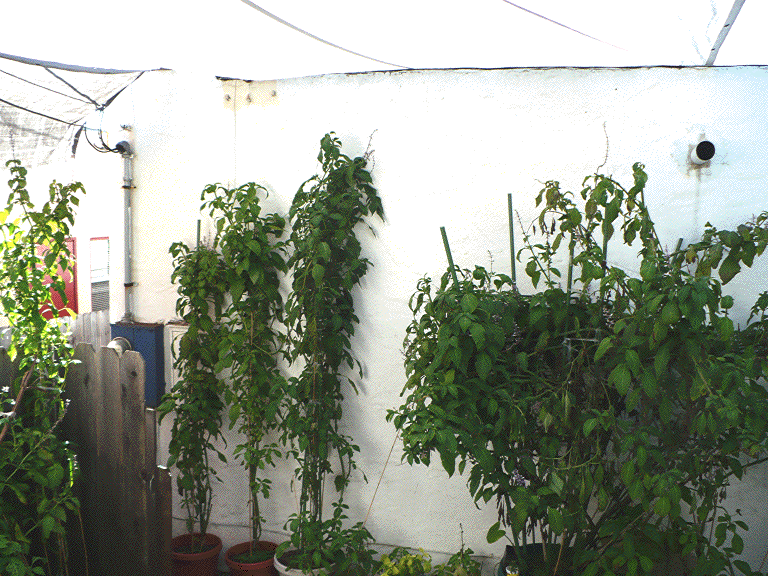
The image size is (768, 576). What are the coordinates of `gray wall` in the screenshot? It's located at click(406, 521).